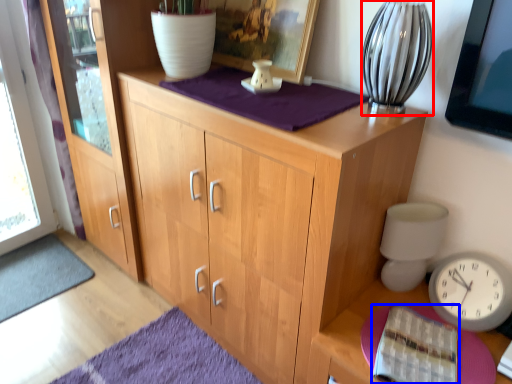
Question: Which point is further to the camera, glass vase (highlighted by a red box) or book (highlighted by a blue box)?

Choices:
 (A) glass vase
 (B) book

Answer: (A)